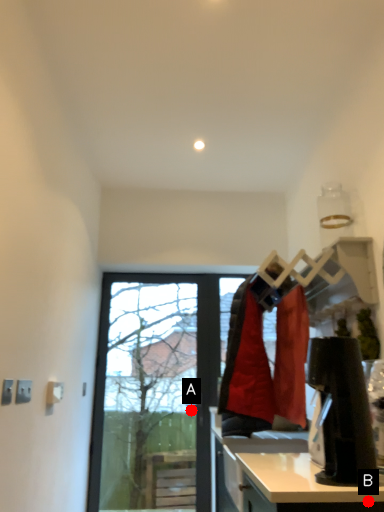
Question: Two points are circled on the image, labeled by A and B beside each circle. Among these points, which one is nearest to the camera?

Choices:
 (A) A is closer
 (B) B is closer

Answer: (B)